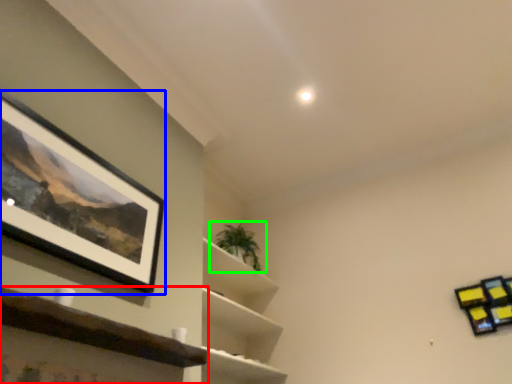
Question: Which object is the farthest from shelf (highlighted by a red box)? Choose among these: picture frame (highlighted by a blue box) or houseplant (highlighted by a green box).

Choices:
 (A) picture frame
 (B) houseplant

Answer: (B)